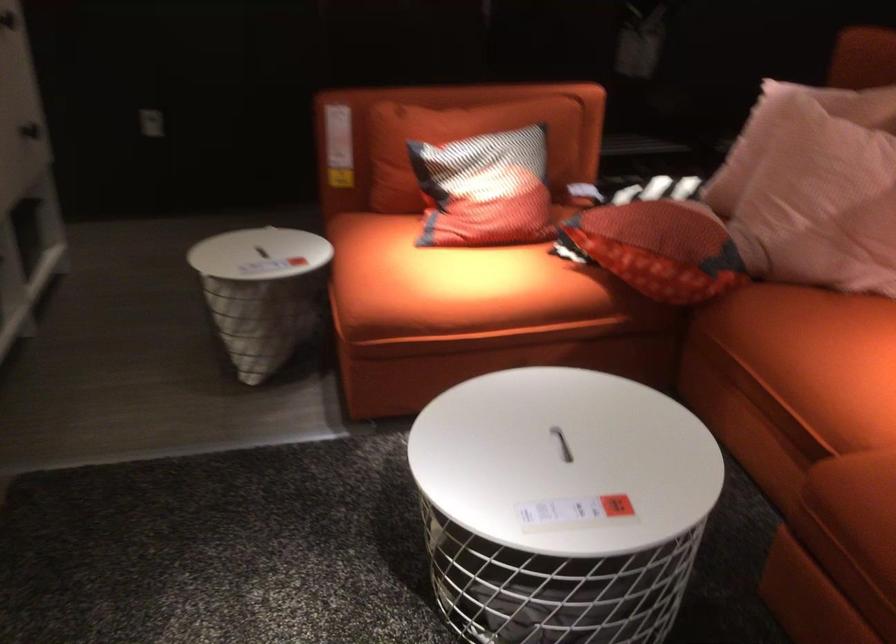
Find where to lift the white basket lid handle. Please return your answer as a coordinate pair (x, y).

(562, 444)